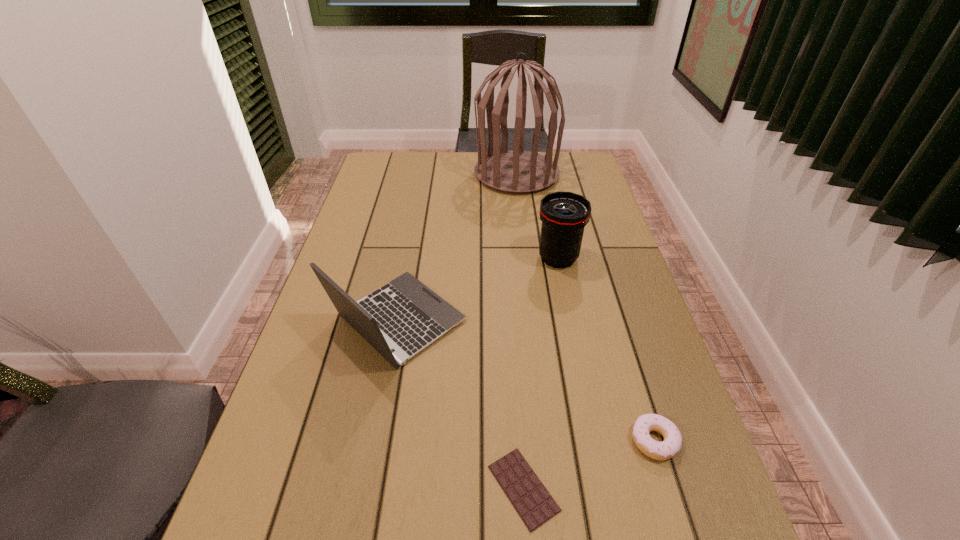
Identify the location of free space located on the left of the second farthest object. This screenshot has width=960, height=540. (438, 258).

Locate an element on the screen. The image size is (960, 540). vacant point located 0.400m on the back of the doughnut is located at coordinates (607, 285).

At what (x,y) coordinates should I click in order to perform the action: click on vacant space located on the right of the chocolate bar. Please return your answer as a coordinate pair (x, y). This screenshot has height=540, width=960. Looking at the image, I should click on (682, 488).

This screenshot has width=960, height=540. Identify the location of object that is at the far edge. (516, 171).

At what (x,y) coordinates should I click in order to perform the action: click on object that is positioned at the left edge. Please return your answer as a coordinate pair (x, y). This screenshot has width=960, height=540. Looking at the image, I should click on (406, 316).

This screenshot has width=960, height=540. Identify the location of birdcage that is at the right edge. (516, 171).

In order to click on telephoto lens at the right edge in this screenshot , I will do `click(564, 215)`.

I want to click on doughnut that is at the right edge, so click(x=672, y=443).

Find the location of a particular element. The height and width of the screenshot is (540, 960). object located in the far right corner section of the desktop is located at coordinates (516, 171).

I want to click on vacant region at the far edge of the desktop, so click(x=425, y=156).